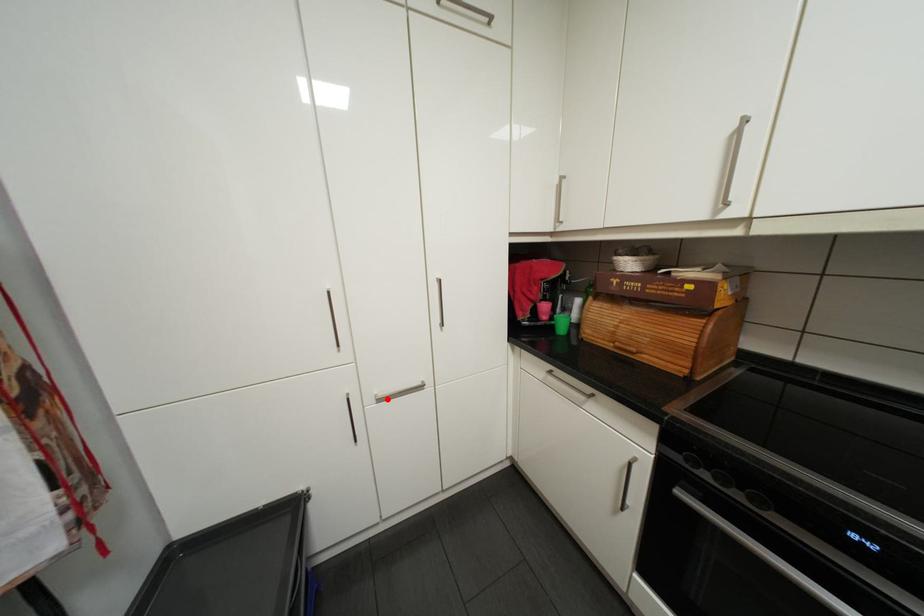
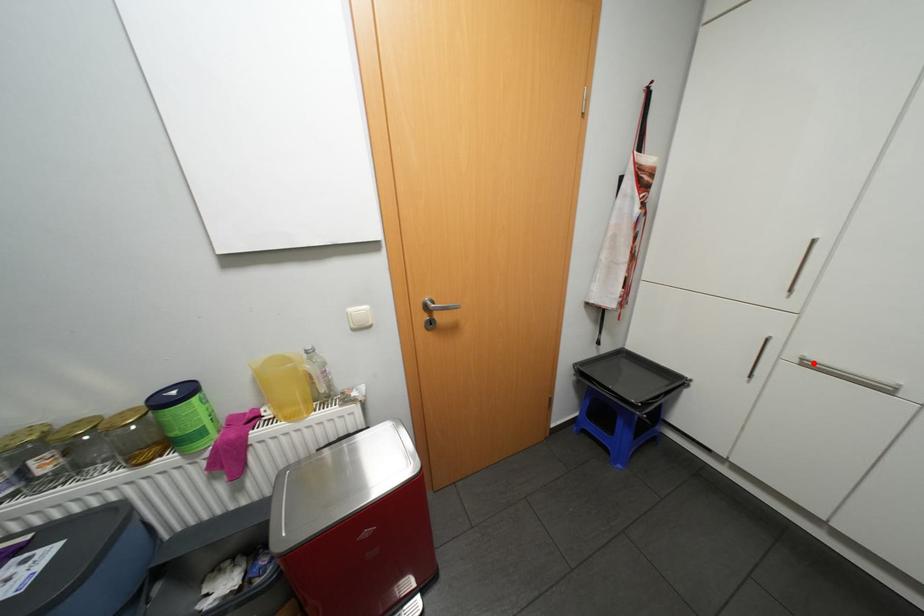
I am providing you with two images of the same scene from different viewpoints. A red point is marked on the first image and another point is marked on the second image. Do the highlighted points in image1 and image2 indicate the same real-world spot?

Yes